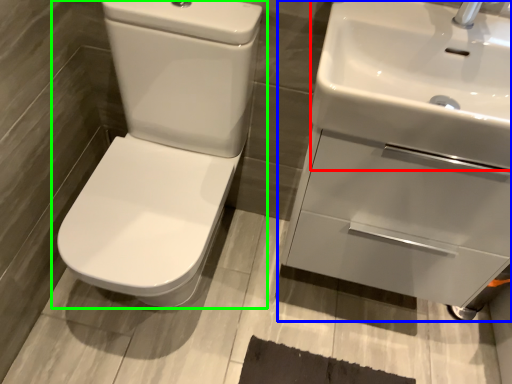
Question: Which object is the farthest from sink (highlighted by a red box)? Choose among these: sink (highlighted by a blue box) or toilet (highlighted by a green box).

Choices:
 (A) sink
 (B) toilet

Answer: (B)